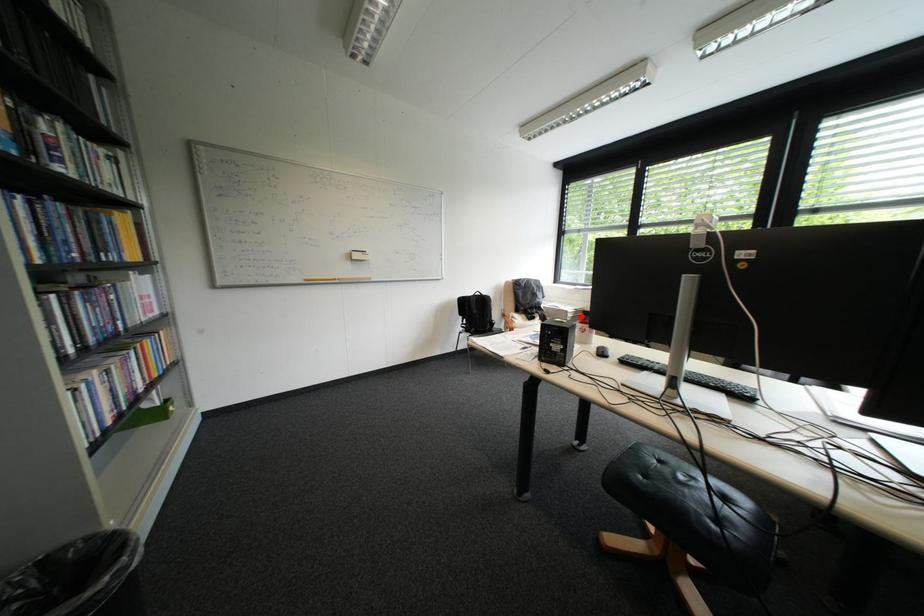
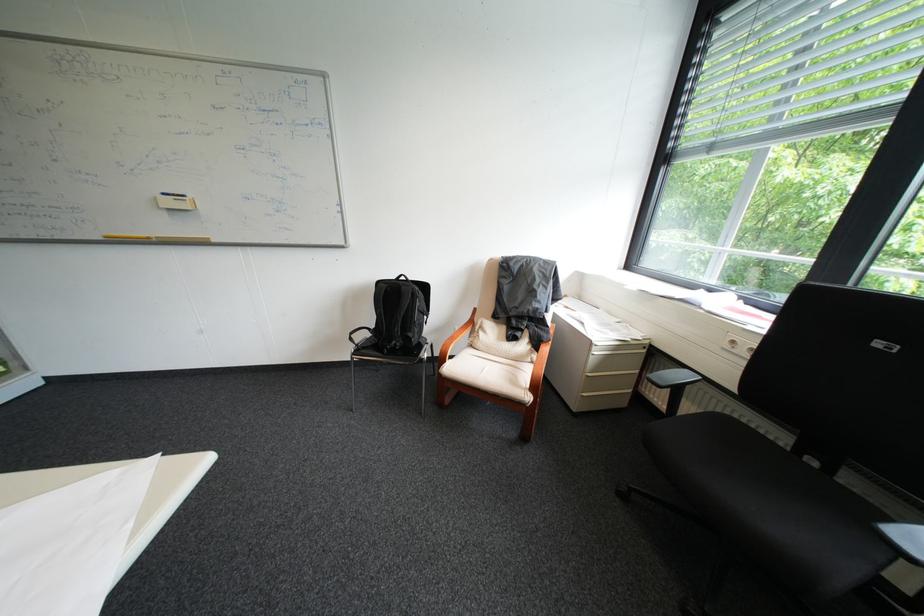
Find the pixel in the second image that matches the highlighted location in the first image.

(609, 353)